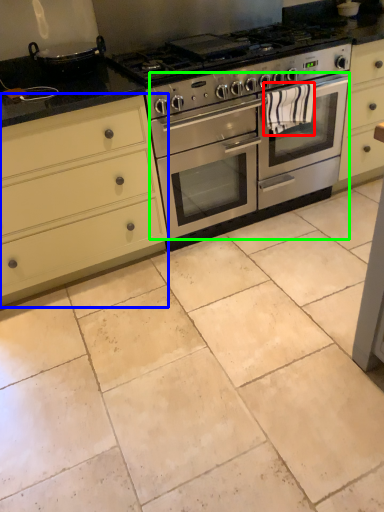
Question: Which is farther away from material (highlighted by a red box)? cabinetry (highlighted by a blue box) or oven (highlighted by a green box)?

Choices:
 (A) cabinetry
 (B) oven

Answer: (A)